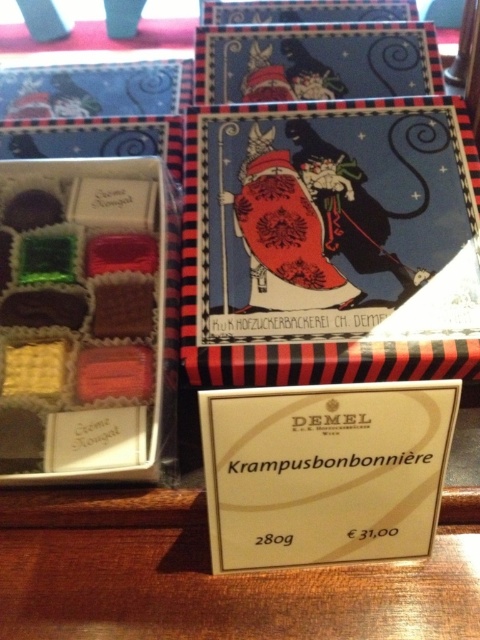
Based on the photo, you are standing in front of the DEMEL confectionery display. You see a point at coordinates point (447, 221). If you want to place a small gift card on the display, can you fit it between the point and the edge of the display without overlapping anything else? The gift card is 2 feet wide.

The distance between the point (447, 221) and the edge of the display is not provided in the scene description, so it is impossible to determine if the gift card will fit without overlapping anything else.

You are at a store and want to buy a gift for someone who prefers smaller items. You see the matte red box at upper center and the matte chocolate box at center. Which one should you choose?

The matte chocolate box at center is smaller than the matte red box at upper center, so you should choose the matte chocolate box at center.

Based on the scene description, where is the matte red box at upper center located in terms of coordinates?

The matte red box at upper center is located at point coordinates of (321, 236).